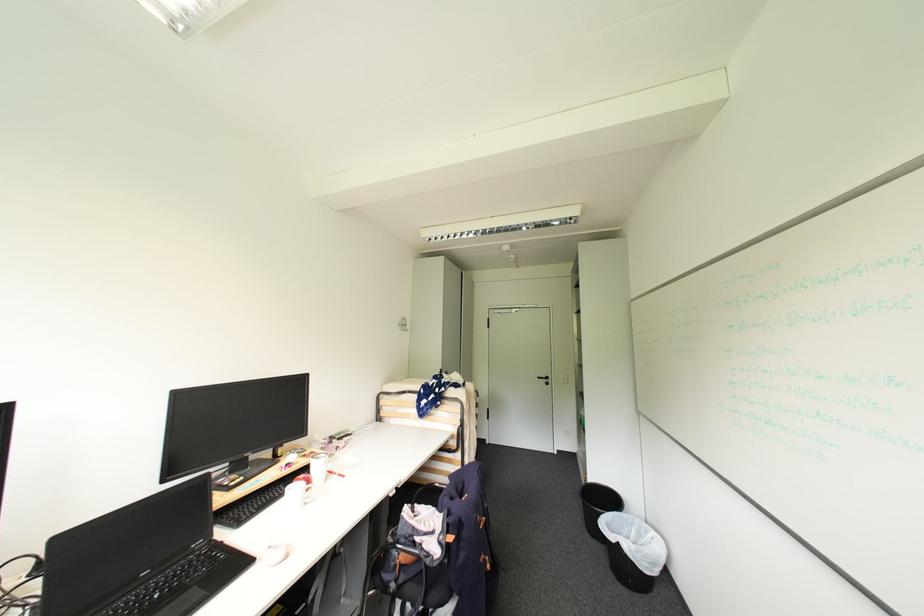
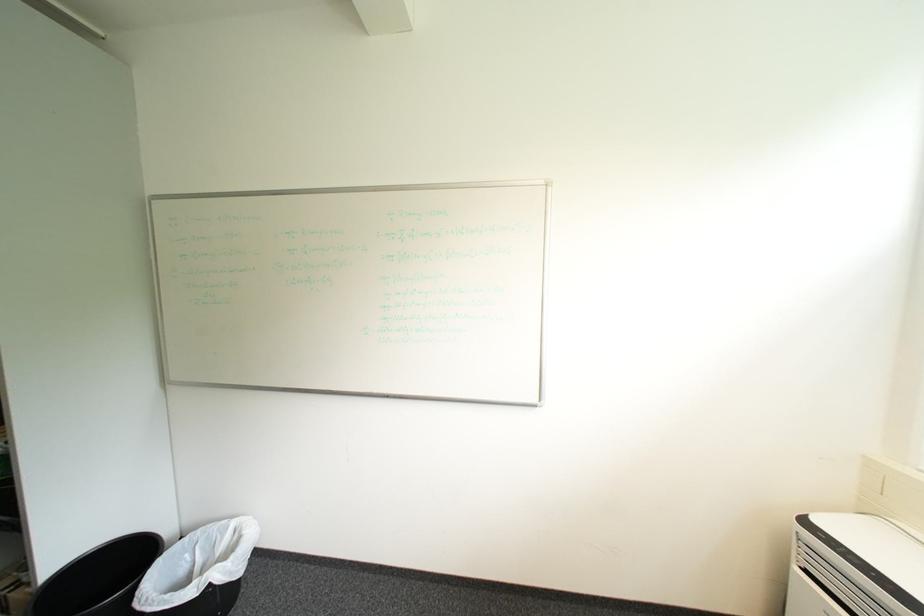
Question: How did the camera likely rotate?

Choices:
 (A) Left
 (B) Right
 (C) Up
 (D) Down

Answer: (B)